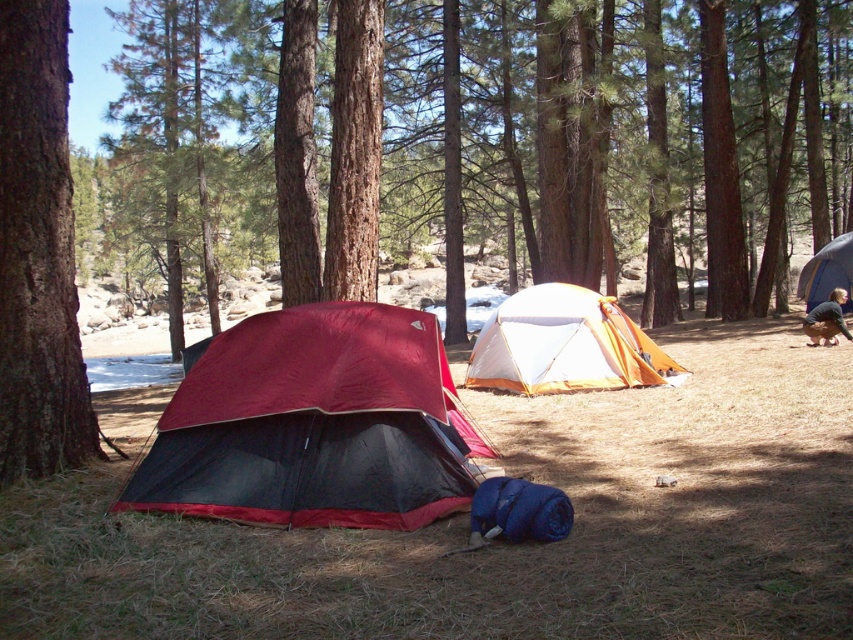
Question: Based on their relative distances, which object is nearer to the orange fabric tent at right?

Choices:
 (A) white/orange fabric tent at center
 (B) brown rough bark tree at left
 (C) maroon fabric tent at center

Answer: (A)

Question: Among these objects, which one is nearest to the camera?

Choices:
 (A) maroon fabric tent at center
 (B) brown rough bark tree at left
 (C) white/orange fabric tent at center
 (D) orange fabric tent at right

Answer: (A)

Question: Is brown rough bark tree at left wider than white/orange fabric tent at center?

Choices:
 (A) yes
 (B) no

Answer: (B)

Question: Does maroon fabric tent at center appear on the right side of white/orange fabric tent at center?

Choices:
 (A) yes
 (B) no

Answer: (B)

Question: Which is farther from the maroon fabric tent at center?

Choices:
 (A) brown rough bark tree at left
 (B) orange fabric tent at right
 (C) white/orange fabric tent at center

Answer: (B)

Question: Can you confirm if white/orange fabric tent at center is smaller than orange fabric tent at right?

Choices:
 (A) yes
 (B) no

Answer: (B)